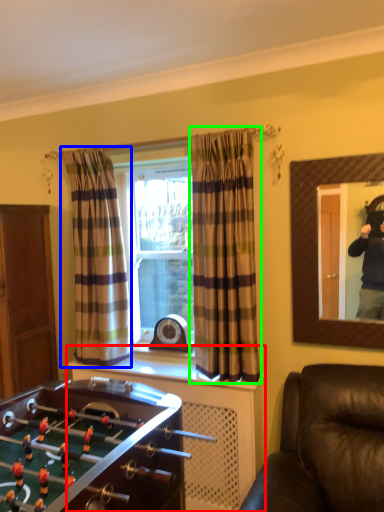
Question: Which is farther away from dresser (highlighted by a red box)? curtain (highlighted by a blue box) or curtain (highlighted by a green box)?

Choices:
 (A) curtain
 (B) curtain

Answer: (A)